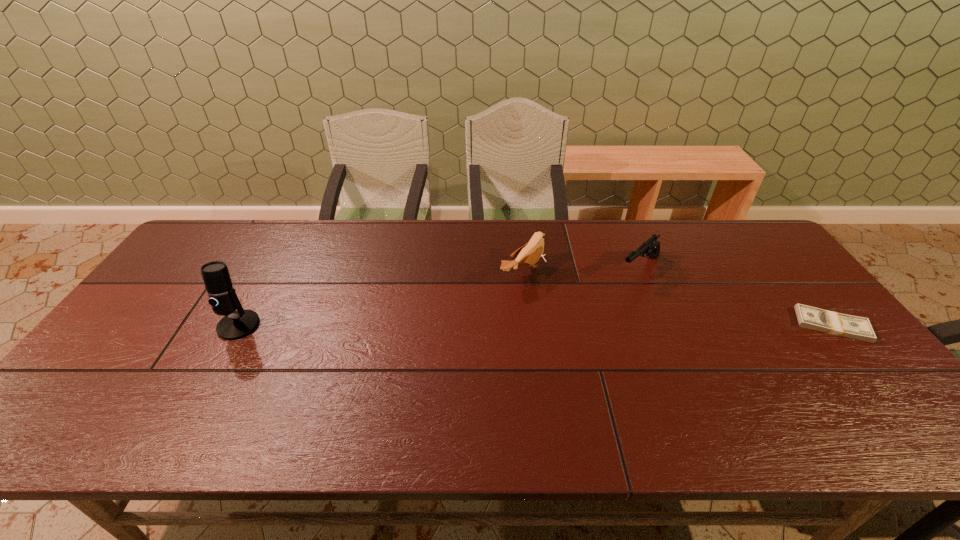
In the image, there is a desktop. In order to click on vacant region at the right edge in this screenshot , I will do `click(843, 349)`.

You are a GUI agent. You are given a task and a screenshot of the screen. Output one action in this format:
    pyautogui.click(x=<x>, y=<y>)
    Task: Click on the vacant space at the far left corner of the desktop
    This screenshot has width=960, height=540.
    Given the screenshot: What is the action you would take?
    pyautogui.click(x=248, y=220)

Identify the location of vacant region at the far right corner. (735, 259).

At what (x,y) coordinates should I click in order to perform the action: click on free spot between the bird and the microphone. Please return your answer as a coordinate pair (x, y). Looking at the image, I should click on (381, 299).

I want to click on vacant area that lies between the dollar and the leftmost object, so click(536, 325).

Find the location of `vacant space that is in between the tallest object and the second object from left to right`. vacant space that is in between the tallest object and the second object from left to right is located at coordinates (381, 299).

Find the location of `blank region between the bird and the dollar`. blank region between the bird and the dollar is located at coordinates (678, 299).

You are a GUI agent. You are given a task and a screenshot of the screen. Output one action in this format:
    pyautogui.click(x=<x>, y=<y>)
    Task: Click on the free space between the microphone and the bird
    The image size is (960, 540).
    Given the screenshot: What is the action you would take?
    pyautogui.click(x=381, y=299)

The image size is (960, 540). Find the location of `free spot between the second object from left to right and the gun`. free spot between the second object from left to right and the gun is located at coordinates (582, 270).

Where is `vacant space that's between the rightmost object and the gun`? This screenshot has width=960, height=540. vacant space that's between the rightmost object and the gun is located at coordinates (736, 296).